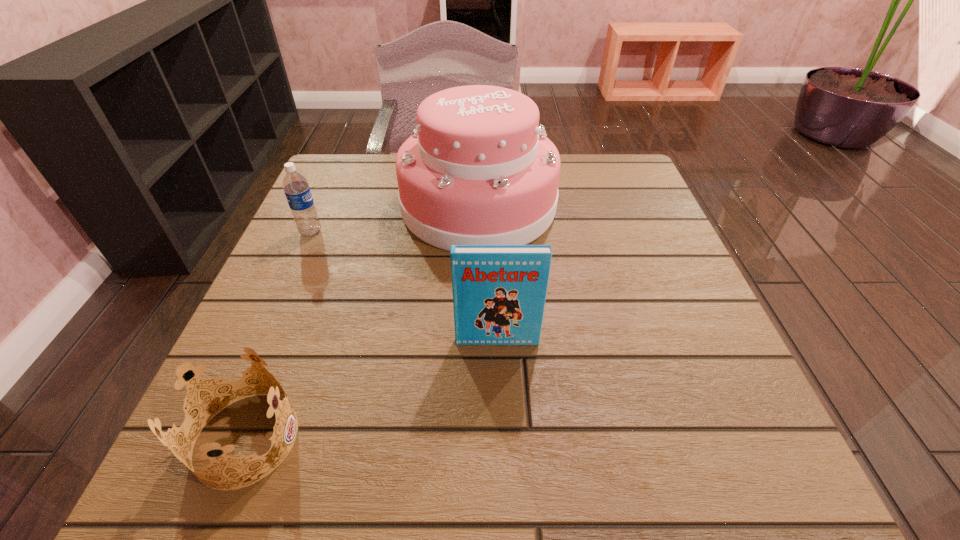
What are the coordinates of `vacant region at the near right corner of the desktop` in the screenshot? It's located at (712, 469).

Locate an element on the screen. Image resolution: width=960 pixels, height=540 pixels. free space between the third tallest object and the book is located at coordinates (404, 287).

The width and height of the screenshot is (960, 540). Identify the location of vacant area that lies between the nearest object and the book. (372, 390).

Find the location of a particular element. The width and height of the screenshot is (960, 540). unoccupied area between the water bottle and the book is located at coordinates (404, 287).

Where is `vacant space that's between the water bottle and the cake`? The height and width of the screenshot is (540, 960). vacant space that's between the water bottle and the cake is located at coordinates (395, 219).

Locate an element on the screen. Image resolution: width=960 pixels, height=540 pixels. blank region between the second shortest object and the book is located at coordinates (404, 287).

Identify the location of vacant region between the water bottle and the crown. This screenshot has height=540, width=960. (278, 335).

Locate an element on the screen. empty location between the nearest object and the third tallest object is located at coordinates (278, 335).

What are the coordinates of `vacant space that is in between the nearest object and the third farthest object` in the screenshot? It's located at (372, 390).

You are a GUI agent. You are given a task and a screenshot of the screen. Output one action in this format:
    pyautogui.click(x=<x>, y=<y>)
    Task: Click on the unoccupied position between the cake and the crown
    The width and height of the screenshot is (960, 540).
    Given the screenshot: What is the action you would take?
    pyautogui.click(x=363, y=321)